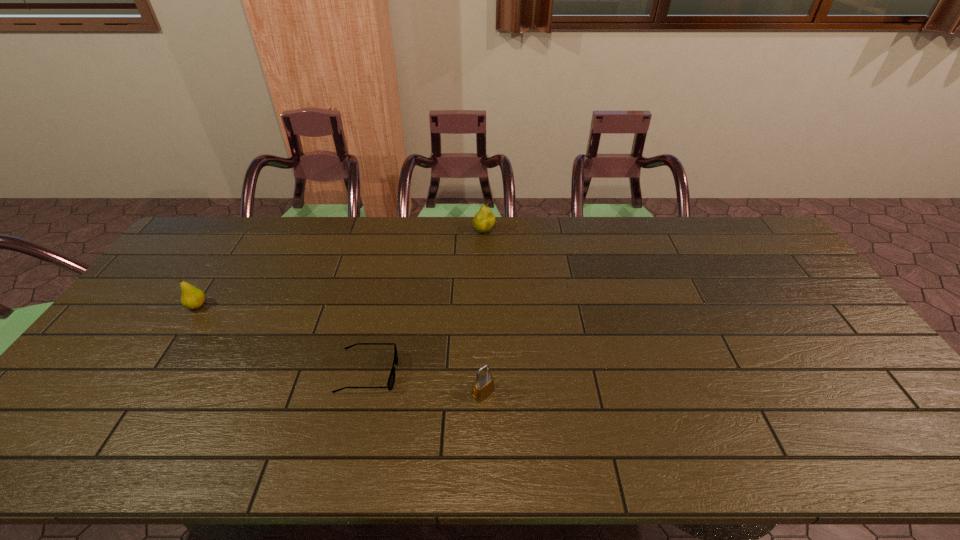
Locate an element on the screen. The width and height of the screenshot is (960, 540). the farthest object is located at coordinates (484, 219).

Where is `the farther pear`? the farther pear is located at coordinates (484, 219).

The height and width of the screenshot is (540, 960). In order to click on the nearer pear in this screenshot , I will do `click(192, 298)`.

The height and width of the screenshot is (540, 960). Find the location of `the left pear`. the left pear is located at coordinates (192, 298).

Identify the location of padlock. (483, 385).

This screenshot has height=540, width=960. Identify the location of the shortest object. (391, 379).

I want to click on the second object from left to right, so click(x=391, y=379).

Find the location of a particular element. The width and height of the screenshot is (960, 540). blank space located 0.270m on the left of the farthest object is located at coordinates (398, 232).

Locate an element on the screen. This screenshot has height=540, width=960. free location located 0.080m on the left of the third nearest object is located at coordinates (160, 306).

Locate an element on the screen. This screenshot has height=540, width=960. vacant space situated 0.090m on the left of the padlock is located at coordinates [x=436, y=393].